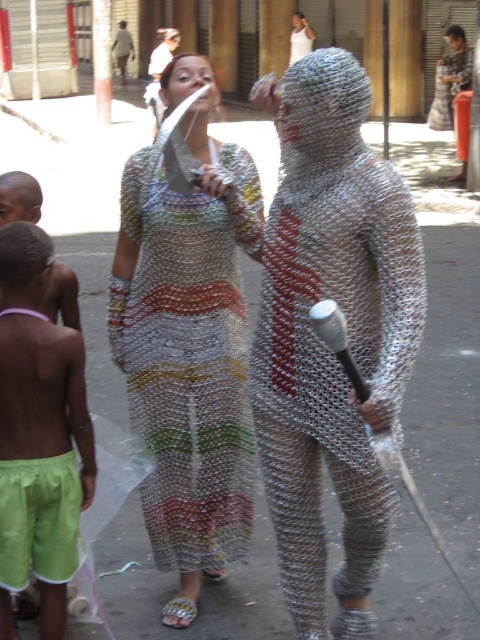
You are a photographer positioned at the front of the street scene. You want to take a photo that includes both the multicolored mesh dress at center and the metallic chainmail suit at upper right. Which object will appear larger in the photo?

The multicolored mesh dress at center will appear larger in the photo because it is closer to the viewer than the metallic chainmail suit at upper right.

You are a photographer trying to capture the best angle of both the multicolored mesh dress at center and the metallic chainmail suit at upper right. Based on their positions, which one should you focus on first to ensure both are in frame?

The multicolored mesh dress at center is below the metallic chainmail suit at upper right. Since the metallic chainmail suit at upper right is positioned higher, you should focus on it first to ensure both are in frame without cropping either.